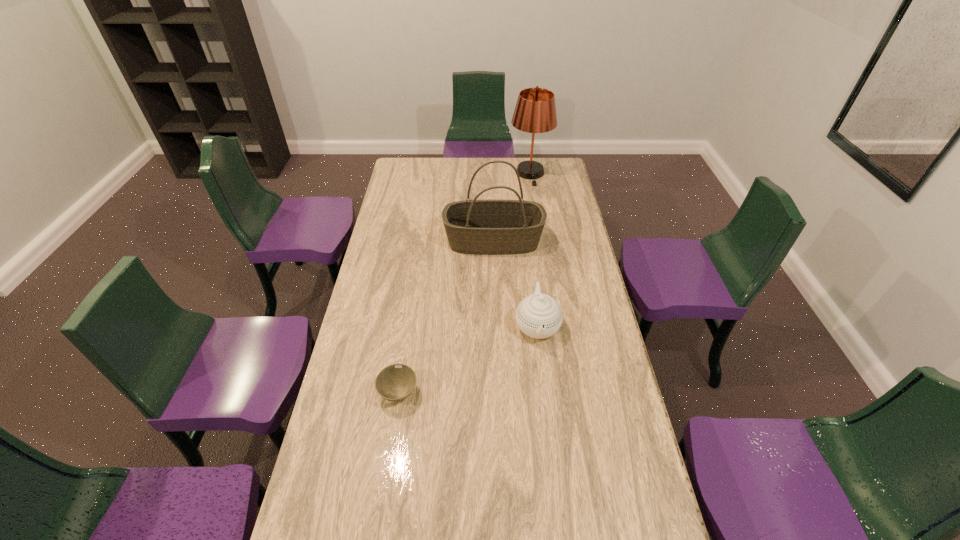
In the image, there is a desktop. Where is `vacant space at the far left corner`? The width and height of the screenshot is (960, 540). vacant space at the far left corner is located at coordinates [401, 160].

This screenshot has width=960, height=540. I want to click on free space between the leftmost object and the farthest object, so click(465, 283).

Locate which object is the third closest to the bowl. Please provide its 2D coordinates. Your answer should be formatted as a tuple, i.e. [(x, y)], where the tuple contains the x and y coordinates of a point satisfying the conditions above.

[(535, 112)]

Identify the location of the second closest object to the nearest object. (488, 227).